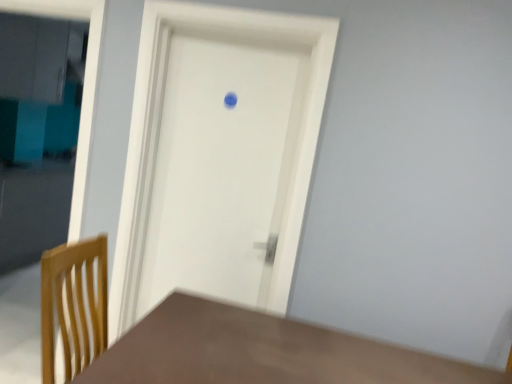
Question: Visually, is white matte door at center positioned to the left or to the right of brown matte table at lower left?

Choices:
 (A) right
 (B) left

Answer: (B)

Question: Considering the positions of white matte door at center and brown matte table at lower left in the image, is white matte door at center wider or thinner than brown matte table at lower left?

Choices:
 (A) thin
 (B) wide

Answer: (A)

Question: Is white matte door at center bigger or smaller than brown matte table at lower left?

Choices:
 (A) small
 (B) big

Answer: (A)

Question: Considering the relative positions of brown matte table at lower left and white matte door at center in the image provided, is brown matte table at lower left to the left or to the right of white matte door at center?

Choices:
 (A) left
 (B) right

Answer: (B)

Question: In terms of size, does brown matte table at lower left appear bigger or smaller than white matte door at center?

Choices:
 (A) small
 (B) big

Answer: (B)

Question: From a real-world perspective, relative to white matte door at center, is brown matte table at lower left vertically above or below?

Choices:
 (A) above
 (B) below

Answer: (B)

Question: Does point (x=202, y=362) appear closer or farther from the camera than point (x=279, y=228)?

Choices:
 (A) farther
 (B) closer

Answer: (B)